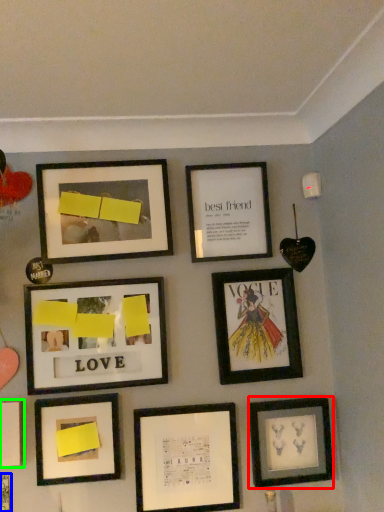
Question: Which object is the farthest from picture frame (highlighted by a red box)? Choose among these: picture frame (highlighted by a blue box) or picture frame (highlighted by a green box).

Choices:
 (A) picture frame
 (B) picture frame

Answer: (A)